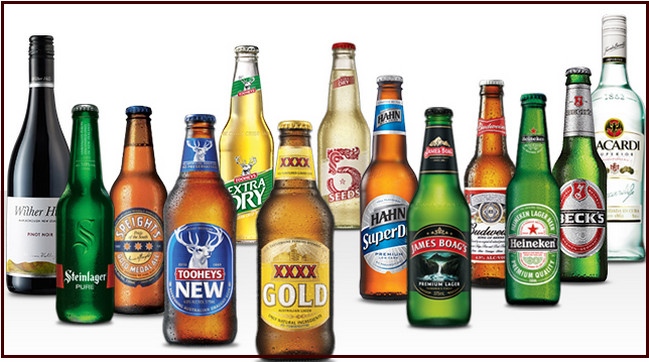
The image size is (649, 362). In order to click on green bottle in this screenshot , I will do `click(95, 240)`, `click(434, 203)`, `click(520, 195)`, `click(570, 163)`.